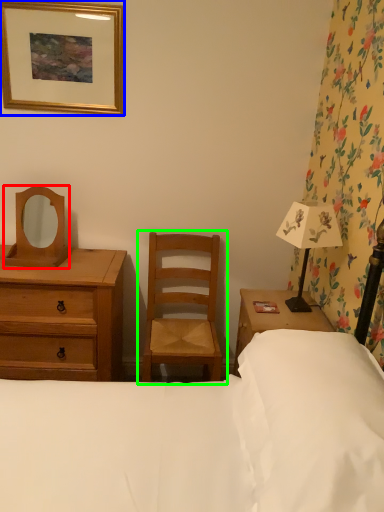
Question: Which object is the closest to the mirror (highlighted by a red box)? Choose among these: picture frame (highlighted by a blue box) or chair (highlighted by a green box).

Choices:
 (A) picture frame
 (B) chair

Answer: (A)